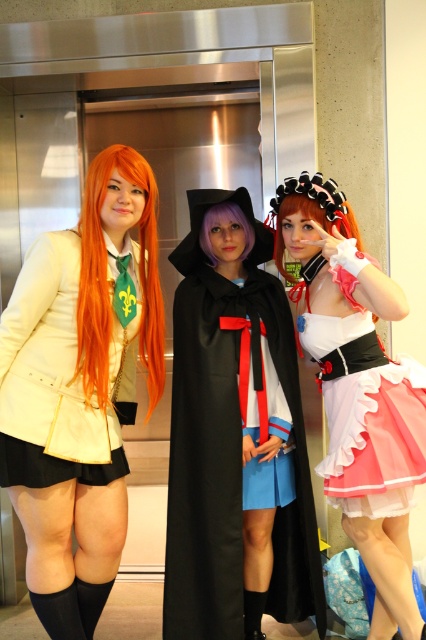
Is point (65, 406) positioned before point (374, 298)?

That is False.

Is point (91, 506) closer to camera compared to point (368, 449)?

No, it is not.

What are the coordinates of `matte white coat at center` in the screenshot? It's located at (80, 388).

The image size is (426, 640). What do you see at coordinates (233, 438) in the screenshot?
I see `black matte cape at center` at bounding box center [233, 438].

Which is behind, point (238, 214) or point (279, 253)?

Positioned behind is point (279, 253).

Describe the element at coordinates (233, 438) in the screenshot. Image resolution: width=426 pixels, height=640 pixels. I see `black matte cape at center` at that location.

At what (x,y) coordinates should I click in order to perform the action: click on black matte cape at center. Please return your answer as a coordinate pair (x, y). Looking at the image, I should click on (233, 438).

Is black matte cape at center to the left of pink satin dress at center from the viewer's perspective?

Yes, black matte cape at center is to the left of pink satin dress at center.

Who is more forward, (218, 396) or (331, 348)?

Point (218, 396) is in front.

The image size is (426, 640). Find the location of `black matte cape at center`. black matte cape at center is located at coordinates (233, 438).